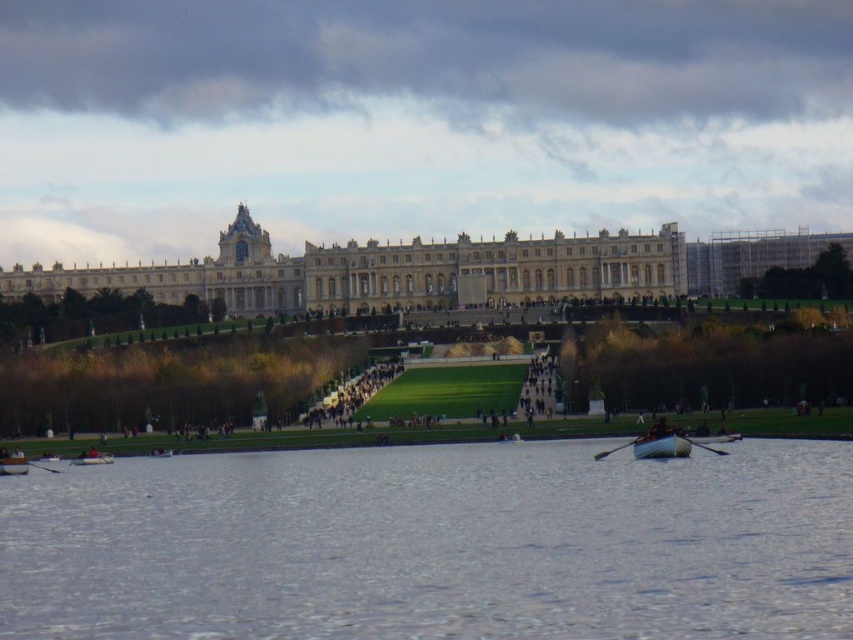
Question: Which object is the closest to the green grass at center?

Choices:
 (A) clear water at lower center
 (B) brown leather jacket at center

Answer: (A)

Question: Is wooden rowboat at lower left wider than wooden smooth paddle at lower center?

Choices:
 (A) no
 (B) yes

Answer: (B)

Question: Is wooden rowboat at lower left wider than white plastic boat at lower left?

Choices:
 (A) no
 (B) yes

Answer: (B)

Question: Estimate the real-world distances between objects in this image. Which object is farther from the wooden rowboat at lower left?

Choices:
 (A) wooden smooth paddle at lower center
 (B) white plastic boat at lower left
 (C) wooden rowboat at lower center
 (D) clear water at lower center

Answer: (C)

Question: Does wooden rowboat at lower center have a larger size compared to wooden smooth paddle at lower center?

Choices:
 (A) yes
 (B) no

Answer: (A)

Question: Which object is closer to the camera taking this photo?

Choices:
 (A) brown leather jacket at center
 (B) wooden smooth paddle at lower center

Answer: (A)